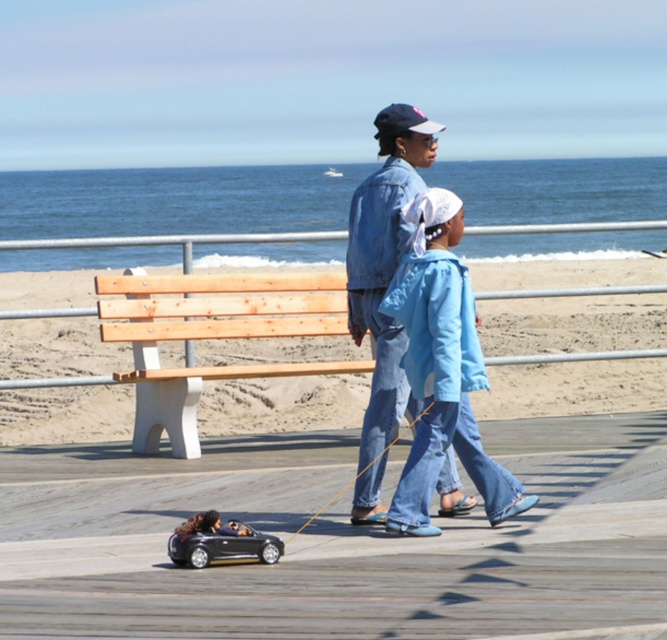
You are a photographer standing on the beach and want to take a photo of the natural wood bench at center and the blue denim jacket at center. Which object should you focus on first if you want to capture both in the same frame without moving the camera?

The natural wood bench at center is taller than the blue denim jacket at center, so you should focus on the natural wood bench at center first to ensure both are in focus.

You are a visitor at the beach and want to sit down on the natural wood bench at center. However, you notice the dark blue fabric baseball cap at upper center above it. Is there enough space between the cap and the bench for you to sit comfortably?

The natural wood bench at center is positioned under the dark blue fabric baseball cap at upper center, so there is enough space between them for you to sit comfortably.

You are standing on the beach and see two points marked on the boardwalk. Which point is closer to you, point (502, 403) or point (408, 356)?

Point (502, 403) is closer to you because it is further to the viewer than point (408, 356).